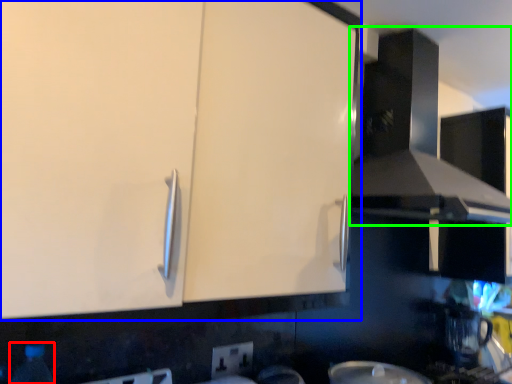
Question: Based on their relative distances, which object is farther from bottle (highlighted by a red box)? Choose from cabinetry (highlighted by a blue box) and exhaust hood (highlighted by a green box).

Choices:
 (A) cabinetry
 (B) exhaust hood

Answer: (B)